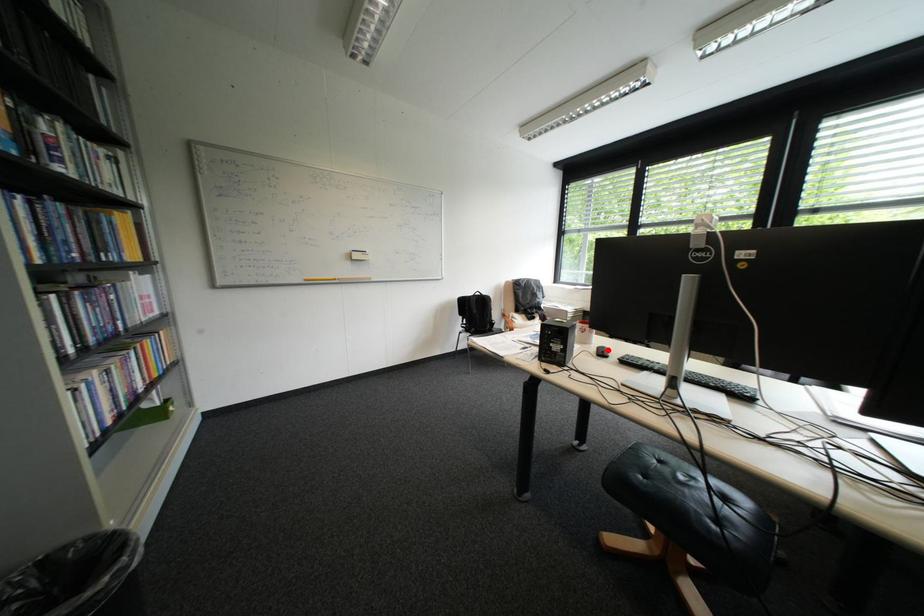
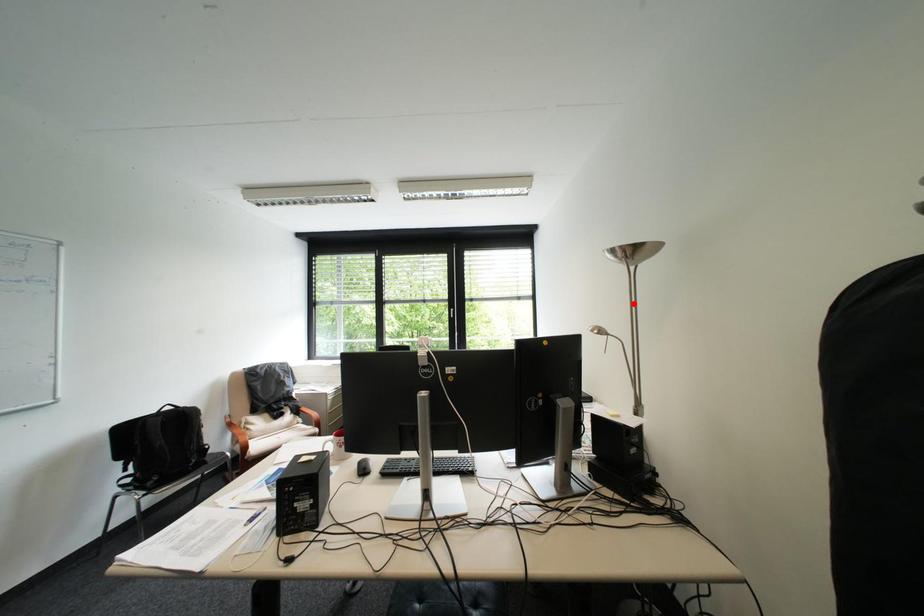
I am providing you with two images of the same scene from different viewpoints. A red point is marked on the first image and another point is marked on the second image. Do the highlighted points in image1 and image2 indicate the same real-world spot?

No